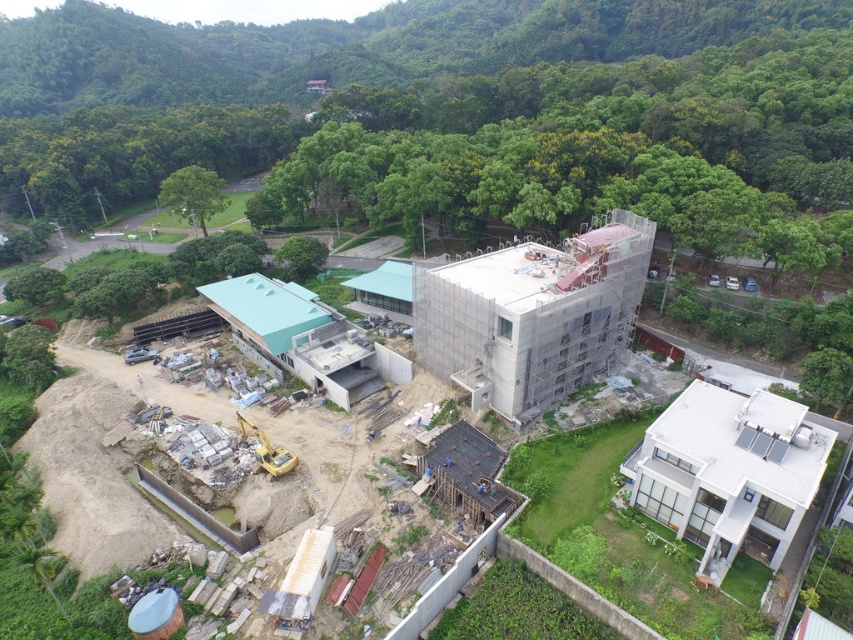
Question: Is the position of sandy concrete building at center less distant than that of scaffolding concrete building at center?

Choices:
 (A) yes
 (B) no

Answer: (B)

Question: Which is nearer to the sandy concrete building at center?

Choices:
 (A) scaffolding concrete building at center
 (B) green leafy tree at center-left

Answer: (A)

Question: Which object is farther from the camera taking this photo?

Choices:
 (A) green leafy tree at center-left
 (B) scaffolding concrete building at center

Answer: (A)

Question: Considering the relative positions of scaffolding concrete building at center and green leafy tree at center-left in the image provided, where is scaffolding concrete building at center located with respect to green leafy tree at center-left?

Choices:
 (A) above
 (B) below

Answer: (B)

Question: Does scaffolding concrete building at center appear over green leafy tree at center-left?

Choices:
 (A) yes
 (B) no

Answer: (B)

Question: Which of these objects is positioned closest to the sandy concrete building at center?

Choices:
 (A) green leafy tree at center-left
 (B) scaffolding concrete building at center

Answer: (B)